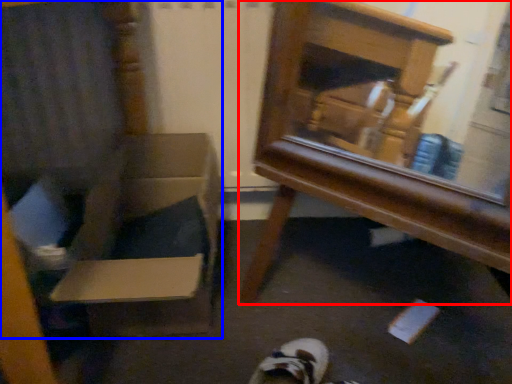
Question: Which object appears closest to the camera in this image, furniture (highlighted by a red box) or armchair (highlighted by a blue box)?

Choices:
 (A) furniture
 (B) armchair

Answer: (B)